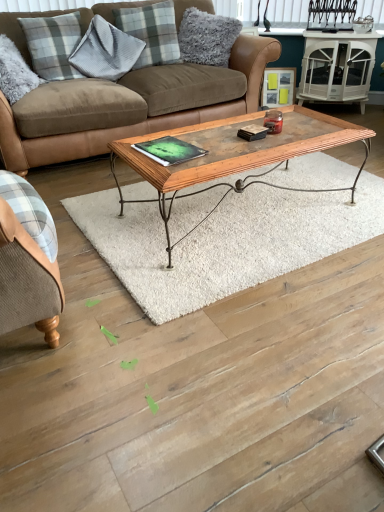
This screenshot has width=384, height=512. What are the coordinates of `free space above wooden glass top coffee table at center (from a real-world perspective)` in the screenshot? It's located at (251, 137).